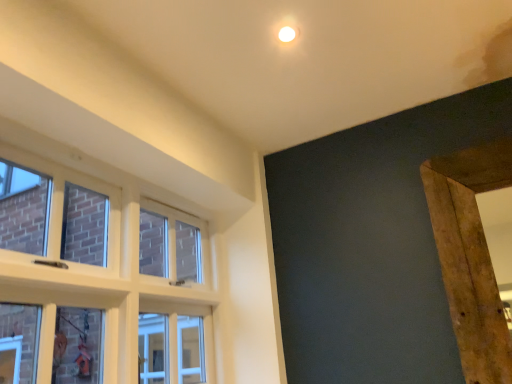
The width and height of the screenshot is (512, 384). What do you see at coordinates (98, 281) in the screenshot? I see `white painted wood window at left` at bounding box center [98, 281].

Identify the location of white painted wood window at left. (98, 281).

Find the location of a particular element. This screenshot has height=384, width=512. white painted wood window at left is located at coordinates (98, 281).